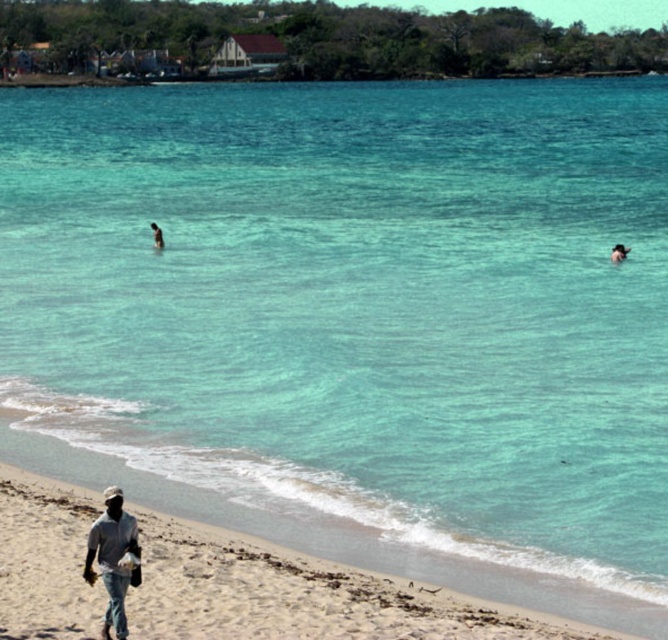
The height and width of the screenshot is (640, 668). Describe the element at coordinates (112, 557) in the screenshot. I see `gray matte shirt at lower left` at that location.

Does gray matte shirt at lower left have a lesser height compared to smooth skin person at upper right?

Incorrect, gray matte shirt at lower left's height does not fall short of smooth skin person at upper right's.

Locate an element on the screen. gray matte shirt at lower left is located at coordinates (112, 557).

Which is behind, point (625, 246) or point (158, 237)?

Point (158, 237)

Is point (627, 253) positioned before point (156, 228)?

Yes, point (627, 253) is closer to viewer.

Measure the distance between smooth skin person at upper right and camera.

They are 41.67 meters apart.

This screenshot has height=640, width=668. Find the location of `smooth skin person at upper right`. smooth skin person at upper right is located at coordinates (619, 252).

Can you confirm if gray matte shirt at lower left is wider than dark skin human at center?

Correct, the width of gray matte shirt at lower left exceeds that of dark skin human at center.

Does gray matte shirt at lower left appear on the left side of dark skin human at center?

In fact, gray matte shirt at lower left is to the right of dark skin human at center.

Which is in front, point (92, 556) or point (164, 243)?

Point (92, 556) is in front.

Where is `gray matte shirt at lower left`? The image size is (668, 640). gray matte shirt at lower left is located at coordinates (112, 557).